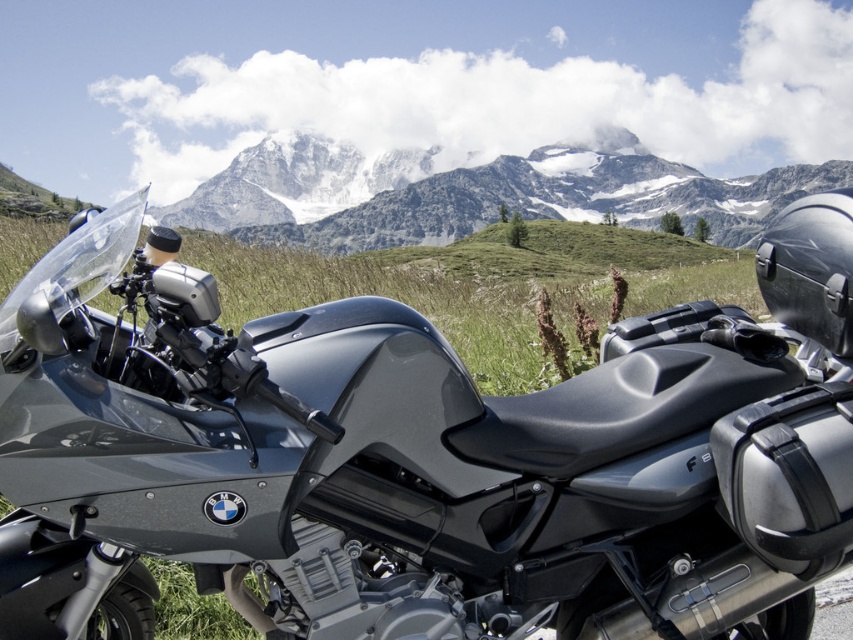
Question: Is matte black motorcycle at lower left wider than snowy granite mountain at upper center?

Choices:
 (A) yes
 (B) no

Answer: (B)

Question: Is matte black motorcycle at lower left positioned behind snowy granite mountain at upper center?

Choices:
 (A) no
 (B) yes

Answer: (A)

Question: Is matte black motorcycle at lower left closer to camera compared to snowy granite mountain at upper center?

Choices:
 (A) no
 (B) yes

Answer: (B)

Question: Which point appears closest to the camera in this image?

Choices:
 (A) (759, 580)
 (B) (610, 192)

Answer: (A)